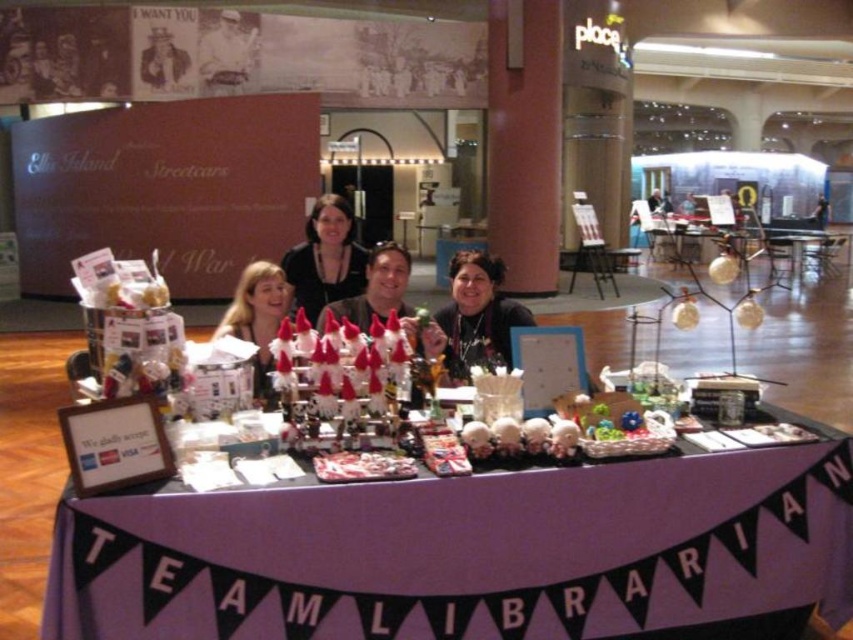
Consider the image. You are standing at a distance of 4 meters from the table where the group is seated. You want to reach the point marked as point (x=296, y=294) on the table. Can you estimate whether you need to move closer or farther away to reach that point?

The distance of point (x=296, y=294) from the camera is 3.94 meters. Since you are currently 4 meters away, you need to move slightly closer to reach the point.

You are a photographer at the event and want to take a clear photo of the matte black shirt at center and the blonde hair at center. Which one is blocking the other?

The blonde hair at center is behind the matte black shirt at center, so the matte black shirt at center is blocking the blonde hair at center.

You are organizing a photoshoot and need to ensure that the two black garments on the table are correctly positioned. The matte black sweater at center and the matte black shirt at center must be arranged so that the wider one is placed to the right side of the narrower one. Based on the scene description, which garment should be placed where?

The matte black sweater at center is narrower than the matte black shirt at center. Therefore, the wider matte black shirt at center should be placed to the right of the narrower matte black sweater at center to meet the requirement.